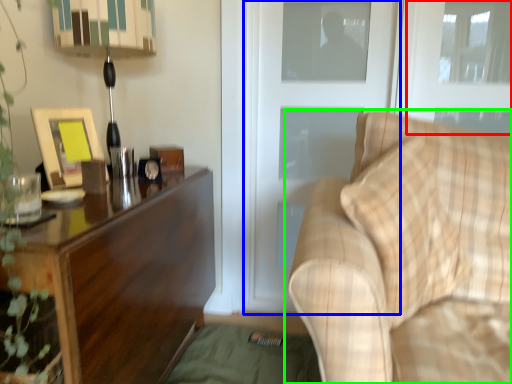
Question: Which object is positioned farthest from window (highlighted by a red box)? Select from screen door (highlighted by a blue box) and studio couch (highlighted by a green box).

Choices:
 (A) screen door
 (B) studio couch

Answer: (B)